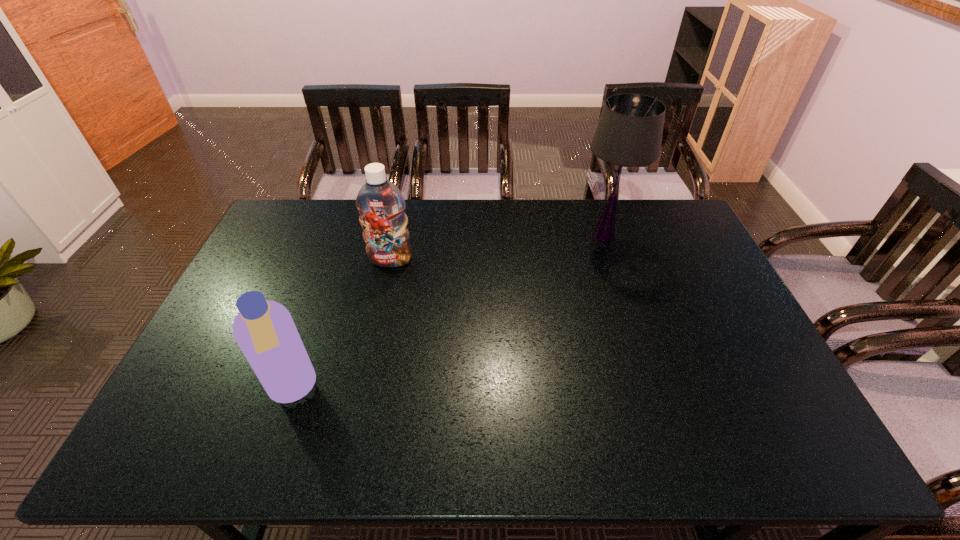
This screenshot has height=540, width=960. Find the location of `free spot between the lampshade and the leftmost object`. free spot between the lampshade and the leftmost object is located at coordinates (448, 313).

At what (x,y) coordinates should I click in order to perform the action: click on vacant region between the rightmost object and the left shampoo. Please return your answer as a coordinate pair (x, y). This screenshot has height=540, width=960. Looking at the image, I should click on (448, 313).

Identify the location of vacant space that is in between the rightmost object and the nearer shampoo. Image resolution: width=960 pixels, height=540 pixels. (448, 313).

This screenshot has height=540, width=960. I want to click on vacant area that lies between the lampshade and the nearer shampoo, so click(448, 313).

The width and height of the screenshot is (960, 540). Find the location of `vacant region between the nearer shampoo and the second object from left to right`. vacant region between the nearer shampoo and the second object from left to right is located at coordinates (341, 325).

Where is `free space that is in between the second object from right to left and the leftmost object`? This screenshot has height=540, width=960. free space that is in between the second object from right to left and the leftmost object is located at coordinates (341, 325).

Where is `object that ranks as the closest to the tallest object`? The width and height of the screenshot is (960, 540). object that ranks as the closest to the tallest object is located at coordinates (380, 203).

Image resolution: width=960 pixels, height=540 pixels. In order to click on object that is the closest to the tallest object in this screenshot , I will do tap(380, 203).

You are a GUI agent. You are given a task and a screenshot of the screen. Output one action in this format:
    pyautogui.click(x=<x>, y=<y>)
    Task: Click on the vacant space that satisfies the following two spatial constraints: 1. on the front-facing side of the rightmost object; 2. on the front label of the farther shampoo
    
    Given the screenshot: What is the action you would take?
    [612, 260]

Where is `vacant space that satisfies the following two spatial constraints: 1. on the front-facing side of the lampshade; 2. on the front label of the second object from left to right`? The width and height of the screenshot is (960, 540). vacant space that satisfies the following two spatial constraints: 1. on the front-facing side of the lampshade; 2. on the front label of the second object from left to right is located at coordinates (612, 260).